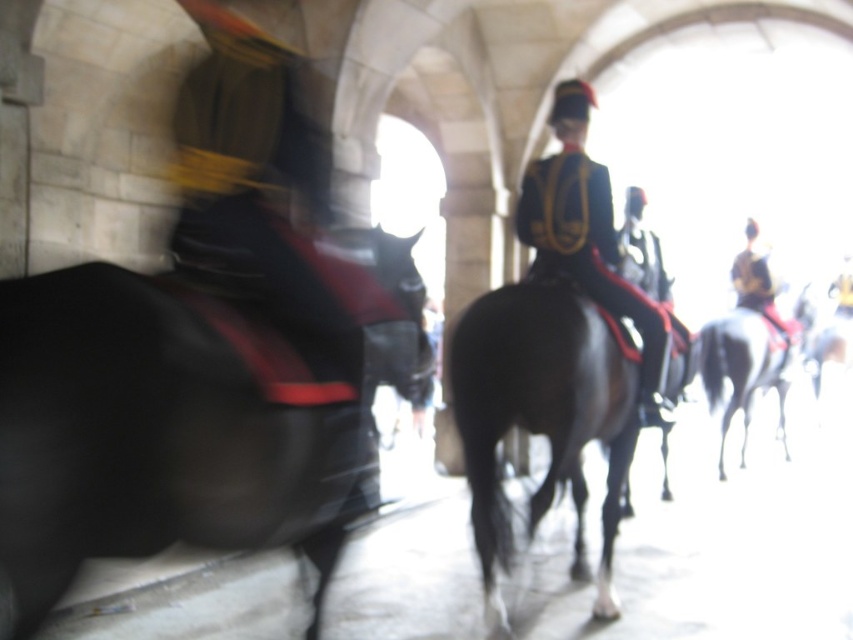
You are a photographer trying to capture a photo of the shiny gold epaulets at center and the black glossy horse at left. Since you want to include both in the frame, which object should you position closer to the left edge of your camera viewfinder?

The black glossy horse at left should be positioned closer to the left edge of the camera viewfinder because it is already on the left side of the shiny gold epaulets at center.

You are a photographer trying to capture a closeup of the shiny gold epaulets at center and the white glossy horse at right in the image. Given their sizes, which one would you need to get closer to in order to fill the frame?

The shiny gold epaulets at center occupies less space than the white glossy horse at right, so you would need to get closer to the shiny gold epaulets at center to fill the frame.

You are a photographer standing in front of the scene. You want to take a photo of the white glossy horse at right and the shiny gold helmet at right. Can you fit both subjects in the frame if your camera has a minimum distance requirement of 16 inches between subjects?

The distance between the white glossy horse at right and the shiny gold helmet at right is 17.00 inches, which is greater than the camera requirement of 16 inches. Therefore, both subjects can be captured in the frame.